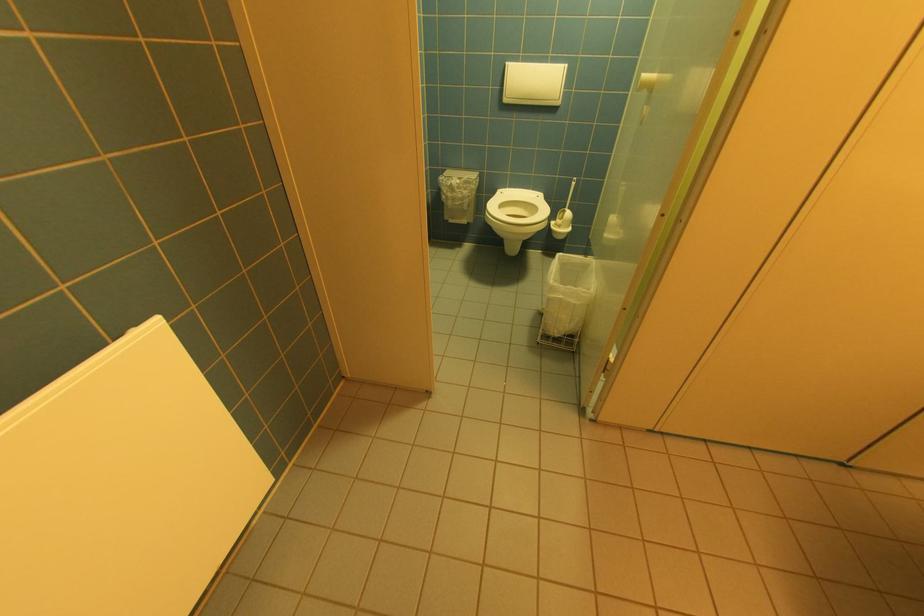
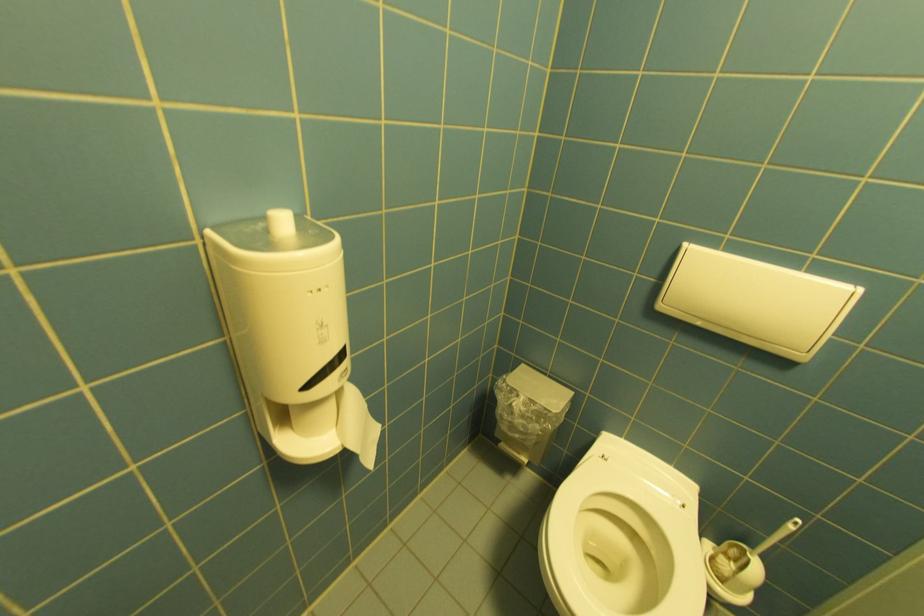
Question: The images are taken continuously from a first-person perspective. In which direction are you moving?

Choices:
 (A) Left
 (B) Right
 (C) Forward
 (D) Backward

Answer: (C)